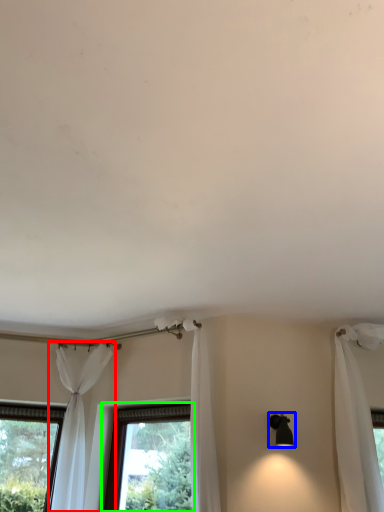
Question: Which is farther away from curtain (highlighted by a red box)? light fixture (highlighted by a blue box) or window (highlighted by a green box)?

Choices:
 (A) light fixture
 (B) window

Answer: (A)